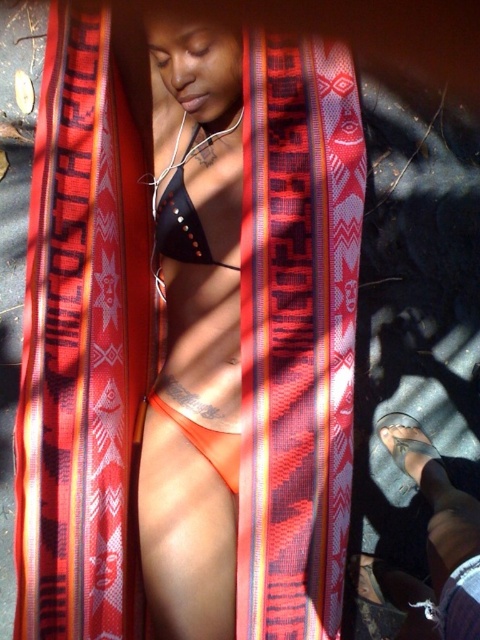
You are a photographer trying to capture the perfect shot of the orange fabric bikini bottom at center and the black studded bikini top at center. Which one should you focus on first if you want to follow the natural left to right reading direction?

The black studded bikini top at center should be focused on first because it is positioned to the left of the orange fabric bikini bottom at center, following the natural left to right reading direction.

You are a fashion designer trying to create a cohesive outfit. You have a black studded bikini top at center and an orange matte bikini at center. Given their positions, can you place them side by side without overlapping?

The black studded bikini top at center and orange matte bikini at center are 17.46 inches apart, so yes, they can be placed side by side without overlapping as there is sufficient space between them.

You are a swimwear designer trying to create a cohesive look for a new collection. You have two orange bikini pieces in front of you, the orange fabric bikini bottom at center and the orange matte bikini at center. Which one has a larger size?

The orange fabric bikini bottom at center is bigger than the orange matte bikini at center, so the orange fabric bikini bottom at center has a larger size.